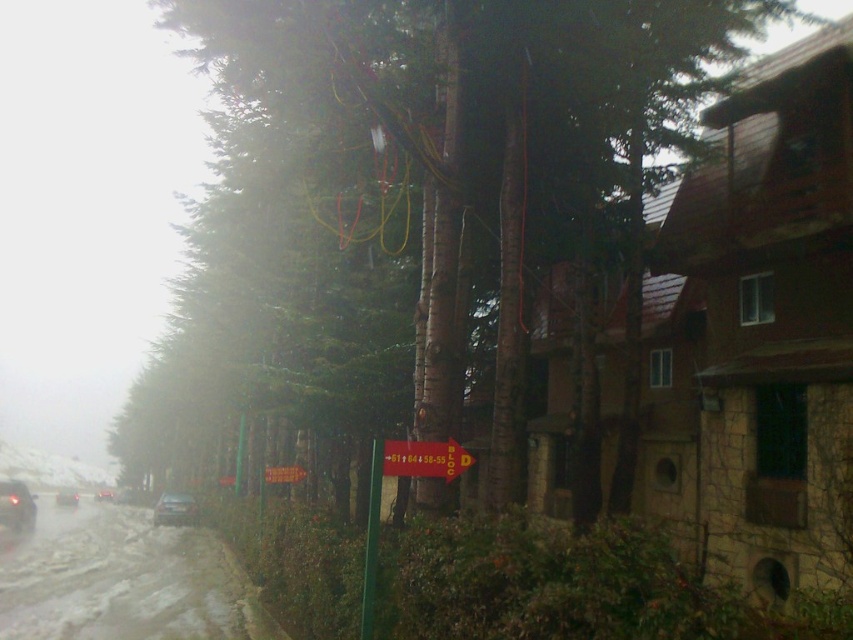
Question: Considering the relative positions of shiny black car at left and shiny black car at lower left in the image provided, where is shiny black car at left located with respect to shiny black car at lower left?

Choices:
 (A) right
 (B) left

Answer: (A)

Question: Which of the following is the closest to the observer?

Choices:
 (A) (563, 113)
 (B) (187, 496)

Answer: (A)

Question: Among these points, which one is farthest from the camera?

Choices:
 (A) (173, 512)
 (B) (735, 1)

Answer: (A)

Question: Which object is positioned farthest from the shiny black car at lower left?

Choices:
 (A) yellow matte sign at center
 (B) shiny black car at left

Answer: (A)

Question: Observing the image, what is the correct spatial positioning of shiny black car at left in reference to shiny silver car at lower left?

Choices:
 (A) above
 (B) below

Answer: (B)

Question: Can you confirm if yellow matte sign at center is smaller than shiny black car at left?

Choices:
 (A) yes
 (B) no

Answer: (A)